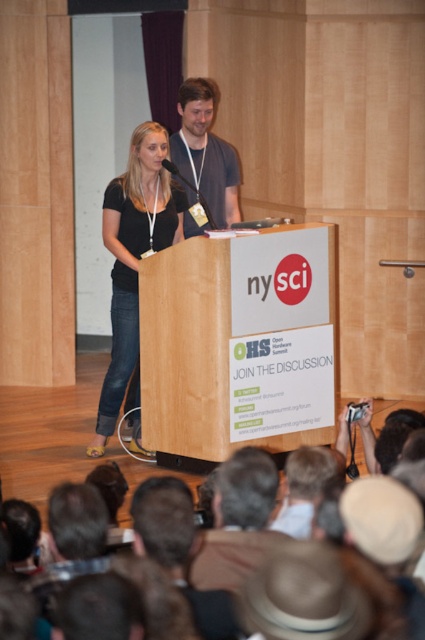
You are an attendee at the OHS Open Hardware Summit and want to approach the speaker at the podium. There is a brown fabric crowd at lower center and a dark gray shirt at center in your way. Which object should you move around to get closer to the speaker?

You should move around the brown fabric crowd at lower center because it is in front of the dark gray shirt at center, meaning the dark gray shirt at center is closer to the speaker and moving around the crowd would allow you to get closer.

You are a speaker at the OHS Open Hardware Summit and need to move from the podium to the dark brown leather jacket at lower center without stepping on the brown fabric crowd at lower center. Can you do it?

The brown fabric crowd at lower center is 8.87 feet away from the dark brown leather jacket at lower center. Since the distance between them is over 8 feet, you can move around the crowd to reach the jacket without stepping on them.